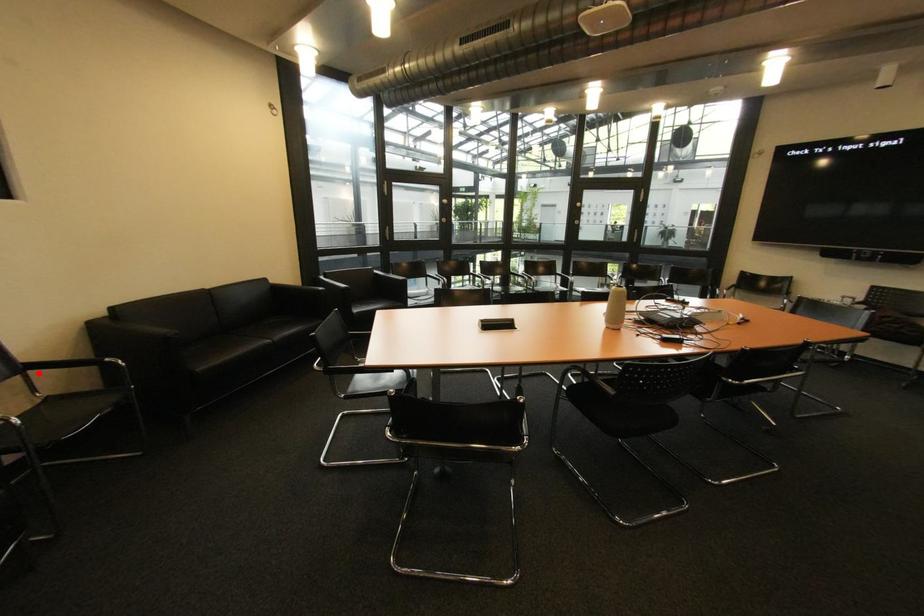
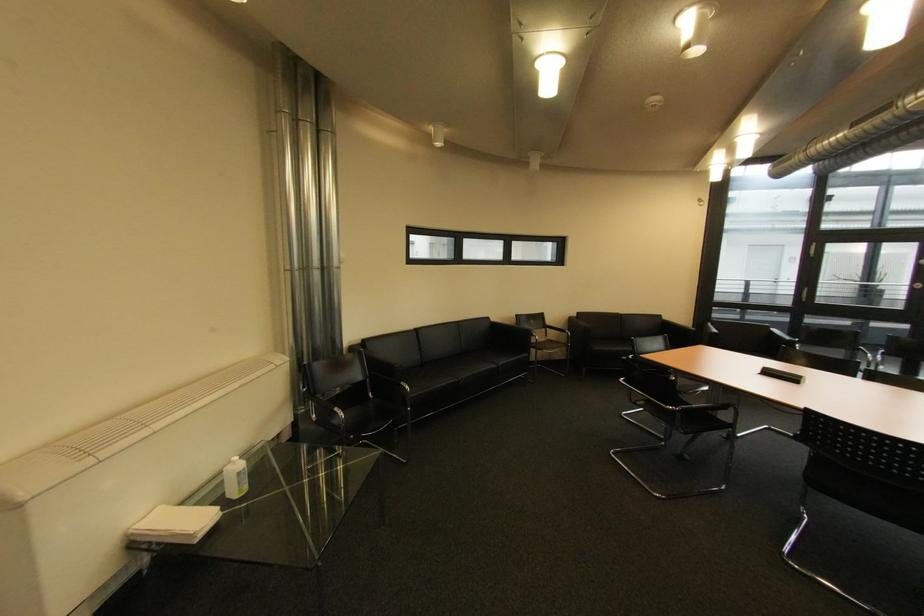
Question: A red point is marked in image1. In image2, is the corresponding 3D point closer to the camera or farther? Reply with the corresponding letter.

Choices:
 (A) The corresponding 3D point is closer.
 (B) The corresponding 3D point is farther.

Answer: (A)